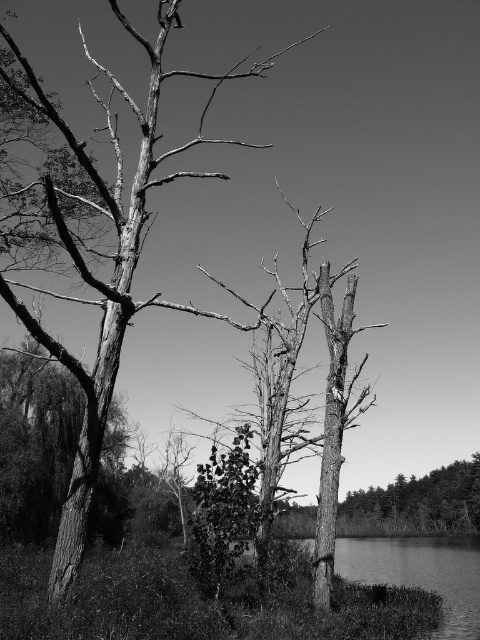
Measure the distance between dead wood tree at center and smooth bark tree at lower right.

dead wood tree at center and smooth bark tree at lower right are 44.15 meters apart.

Is point (22, 104) in front of point (418, 504)?

Yes, point (22, 104) is closer to viewer.

Is point (87, 492) positioned behind point (465, 525)?

No, (87, 492) is closer to viewer.

Find the location of a particular element. dead wood tree at center is located at coordinates (93, 246).

Does smooth water at lower right have a smaller size compared to smooth bark tree at lower right?

Incorrect, smooth water at lower right is not smaller in size than smooth bark tree at lower right.

Which is behind, point (448, 541) or point (396, 484)?

Positioned behind is point (396, 484).

The width and height of the screenshot is (480, 640). Describe the element at coordinates (420, 573) in the screenshot. I see `smooth water at lower right` at that location.

At what (x,y) coordinates should I click in order to perform the action: click on smooth water at lower right. Please return your answer as a coordinate pair (x, y). This screenshot has width=480, height=640. Looking at the image, I should click on (420, 573).

Is dead wood tree at center above smooth water at lower right?

Yes.

Does dead wood tree at center have a greater width compared to smooth water at lower right?

No.

Identify the location of dead wood tree at center. This screenshot has width=480, height=640. (93, 246).